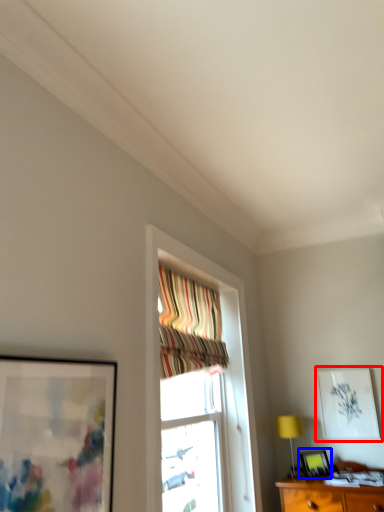
Question: Which point is further to the camera, picture frame (highlighted by a red box) or picture frame (highlighted by a blue box)?

Choices:
 (A) picture frame
 (B) picture frame

Answer: (A)